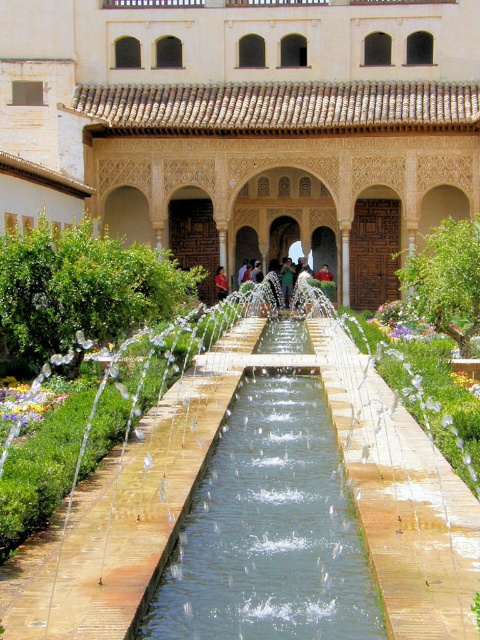
Question: Which of the following is the closest to the observer?

Choices:
 (A) (320, 488)
 (B) (219, 278)

Answer: (A)

Question: Based on their relative distances, which object is farther from the brown wooden palace at center?

Choices:
 (A) red fabric person at center
 (B) green fabric person at center

Answer: (A)

Question: Does clear glass water at center have a smaller size compared to red fabric person at center?

Choices:
 (A) yes
 (B) no

Answer: (B)

Question: Can you confirm if green fabric person at center is positioned below red fabric person at center?

Choices:
 (A) no
 (B) yes

Answer: (B)

Question: Is green fabric person at center bigger than red fabric person at center?

Choices:
 (A) yes
 (B) no

Answer: (A)

Question: Which point is farther from the camera taking this photo?

Choices:
 (A) (225, 276)
 (B) (342, 499)

Answer: (A)